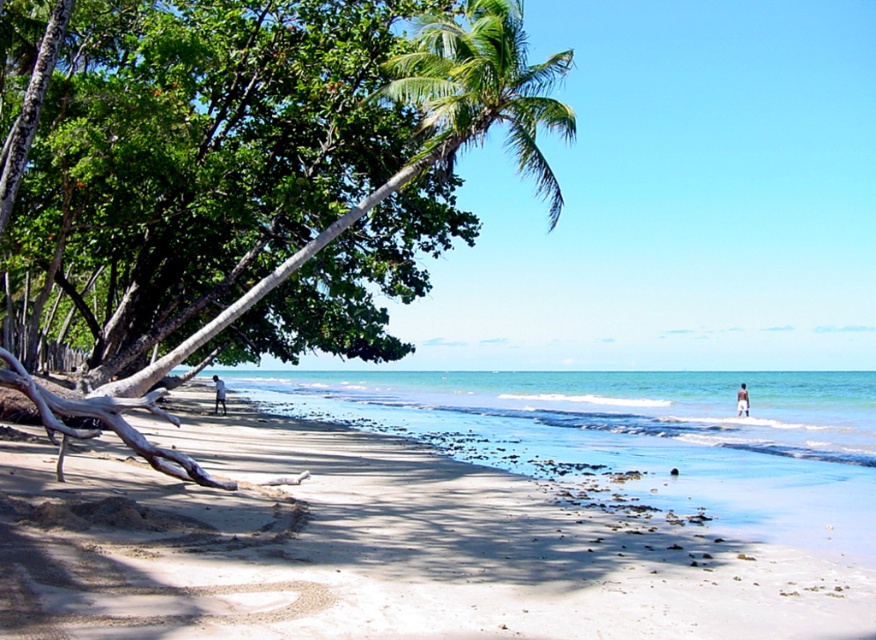
Does light brown skin at lower left appear over light brown skin at beach right?

Indeed, light brown skin at lower left is positioned over light brown skin at beach right.

Can you confirm if light brown skin at lower left is thinner than light brown skin at beach right?

In fact, light brown skin at lower left might be wider than light brown skin at beach right.

Who is more forward, (224, 392) or (747, 412)?

Point (747, 412) is in front.

I want to click on light brown skin at lower left, so [219, 394].

Is white sandy beach at center taller than light brown skin at lower left?

Indeed, white sandy beach at center has a greater height compared to light brown skin at lower left.

From the picture: Who is lower down, white sandy beach at center or light brown skin at lower left?

light brown skin at lower left is below.

Where is `white sandy beach at center`? white sandy beach at center is located at coordinates (392, 547).

In order to click on white sandy beach at center in this screenshot , I will do `click(392, 547)`.

Looking at this image, does white sandy beach at center have a greater width compared to light brown skin at beach right?

Correct, the width of white sandy beach at center exceeds that of light brown skin at beach right.

Which is below, white sandy beach at center or light brown skin at beach right?

light brown skin at beach right

This screenshot has height=640, width=876. In order to click on white sandy beach at center in this screenshot , I will do `click(392, 547)`.